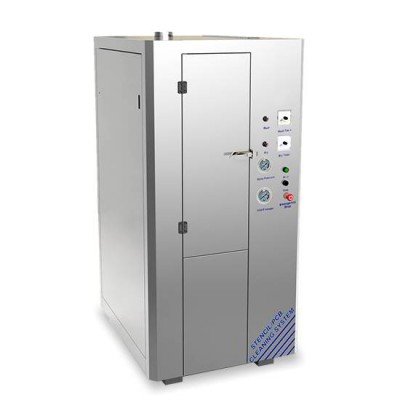
Identify the location of metal appliance. Image resolution: width=400 pixels, height=400 pixels. (160, 178).